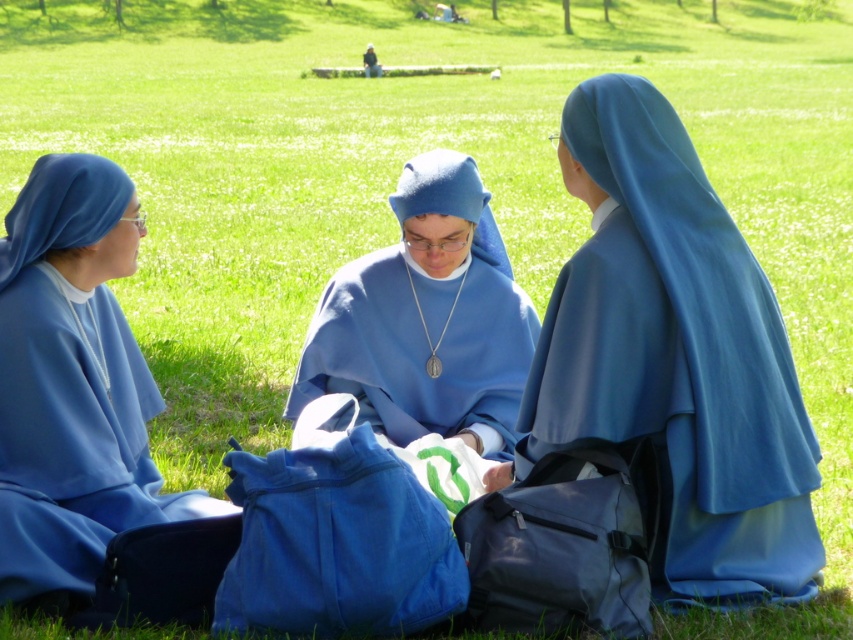
You are an observer standing in front of the three nuns. You notice two robes among them. Which robe takes up more space, the blue matte robe at center or the matte blue robe at left?

The matte blue robe at left takes up more space than the blue matte robe at center because the blue matte robe at center occupies less space than matte blue robe at left according to the description.

You are standing in the park and see two points marked in the image. Which point, point (x=534, y=412) or point (x=421, y=284), is closer to you?

Point (x=534, y=412) is closer to the viewer than point (x=421, y=284).